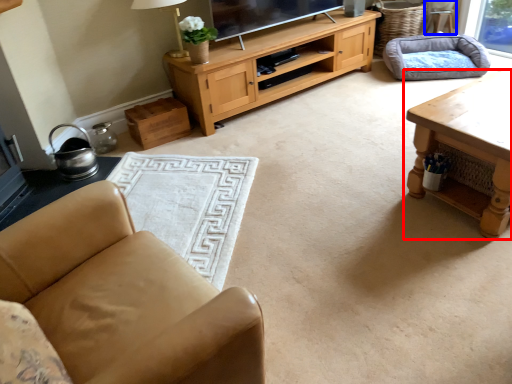
Question: Which of the following is the farthest to the observer, table (highlighted by a red box) or armchair (highlighted by a blue box)?

Choices:
 (A) table
 (B) armchair

Answer: (B)